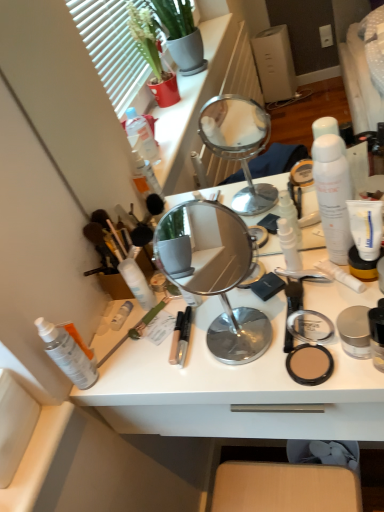
This screenshot has height=512, width=384. In order to click on free space between matte beige compact at right and transparent plastic spray bottle at lower left, the 6th toiletry viewed from the right in this screenshot , I will do `click(196, 376)`.